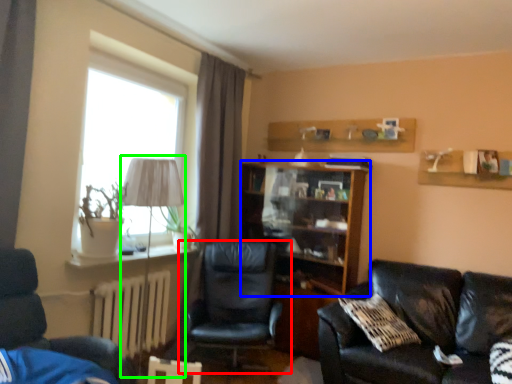
Question: Considering the real-world distances, which object is closest to chair (highlighted by a red box)? shelf (highlighted by a blue box) or table lamp (highlighted by a green box).

Choices:
 (A) shelf
 (B) table lamp

Answer: (A)